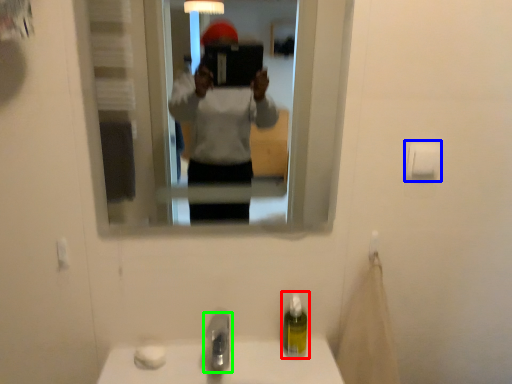
Question: Based on their relative distances, which object is nearer to soap dispenser (highlighted by a red box)? Choose from toilet paper (highlighted by a blue box) and tap (highlighted by a green box).

Choices:
 (A) toilet paper
 (B) tap

Answer: (B)